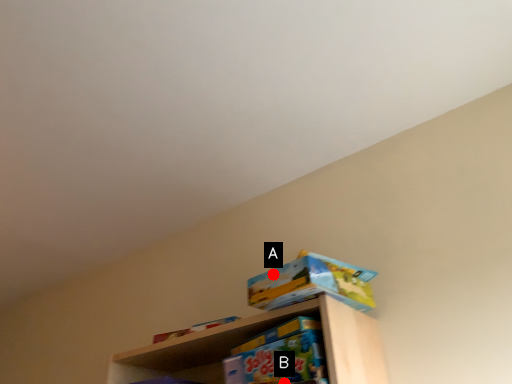
Question: Two points are circled on the image, labeled by A and B beside each circle. Which point is further to the camera?

Choices:
 (A) A is further
 (B) B is further

Answer: (A)